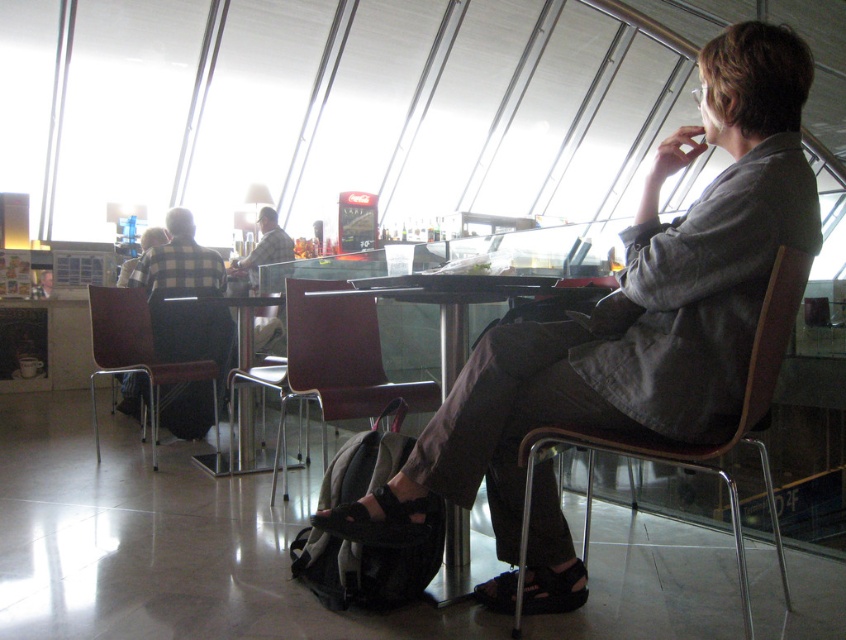
You are a traveler who needs to sit down. You see a brown plastic chair at center and a brown leather chair at left. Which chair is closer to you?

Both the brown plastic chair at center and brown leather chair at left are 30.86 inches apart, so they are equally distant from you.

From the picture: You are standing in the airport lounge and see a matte gray shirt at center and a brown plastic chair at center. Which object is positioned to the right side?

The matte gray shirt at center is to the right of the brown plastic chair at center.

You are a traveler who just entered the airport lounge and need to find the brown plastic chair at center. According to the coordinates provided, where should you look to find it?

The brown plastic chair at center is located at coordinates point (x=317, y=352).